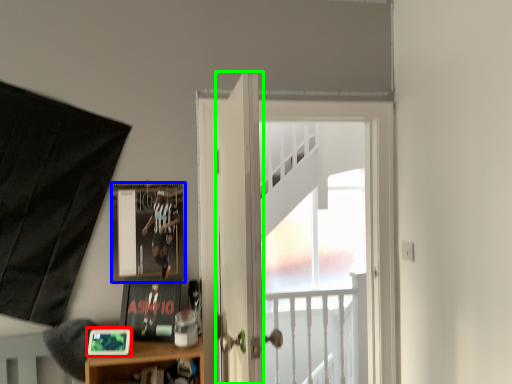
Question: Which is farther away from picture frame (highlighted by a red box)? picture frame (highlighted by a blue box) or door (highlighted by a green box)?

Choices:
 (A) picture frame
 (B) door

Answer: (B)